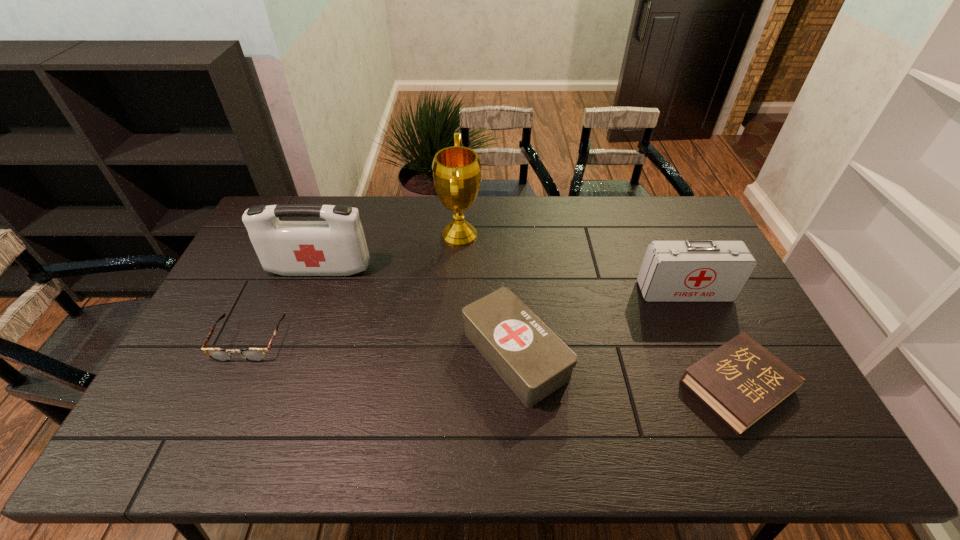
Locate an element on the screen. award is located at coordinates (456, 170).

The height and width of the screenshot is (540, 960). Find the location of `the second tallest object`. the second tallest object is located at coordinates (336, 247).

I want to click on the leftmost first-aid kit, so click(336, 247).

The image size is (960, 540). Identify the location of the fourth nearest object. (692, 270).

Identify the location of the second farthest first-aid kit. Image resolution: width=960 pixels, height=540 pixels. (692, 270).

Locate an element on the screen. The image size is (960, 540). the shortest first-aid kit is located at coordinates (534, 362).

At what (x,y) coordinates should I click in order to perform the action: click on the nearest first-aid kit. Please return your answer as a coordinate pair (x, y). Image resolution: width=960 pixels, height=540 pixels. Looking at the image, I should click on (534, 362).

Find the location of a particular element. The width and height of the screenshot is (960, 540). spectacles is located at coordinates (218, 354).

The height and width of the screenshot is (540, 960). Find the location of `hardback book`. hardback book is located at coordinates (741, 381).

The height and width of the screenshot is (540, 960). I want to click on vacant space situated 0.050m on the front-facing side of the tallest object, so click(x=495, y=235).